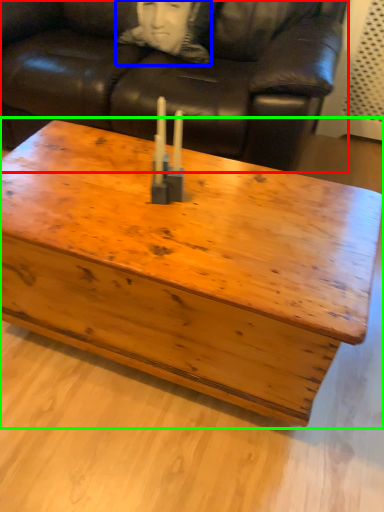
Question: Which object is the closest to the studio couch (highlighted by a red box)? Choose among these: person (highlighted by a blue box) or coffee table (highlighted by a green box).

Choices:
 (A) person
 (B) coffee table

Answer: (A)